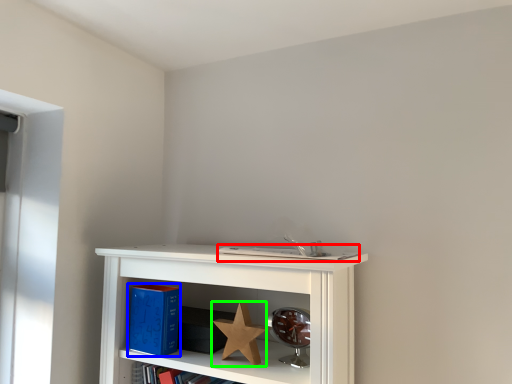
Question: Which object is positioned closest to book (highlighted by a red box)? Select from paperback book (highlighted by a blue box) and star (highlighted by a green box).

Choices:
 (A) paperback book
 (B) star

Answer: (B)